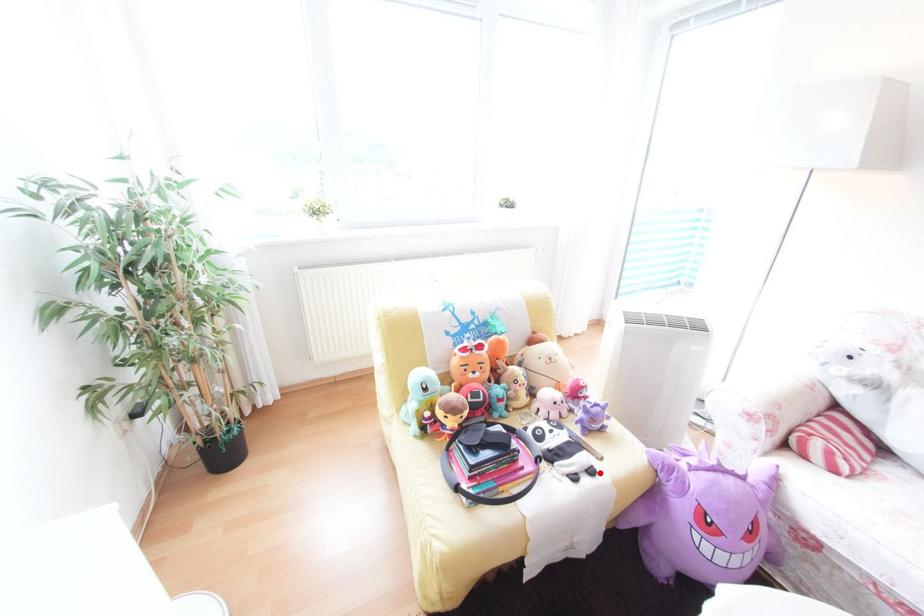
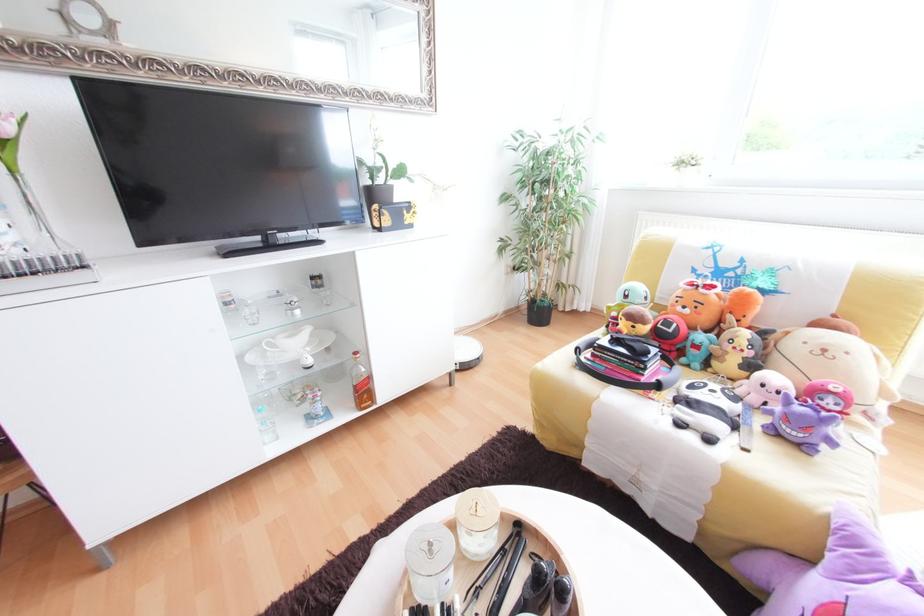
Locate, in the second image, the point that corresponds to the highlighted location in the first image.

(718, 440)